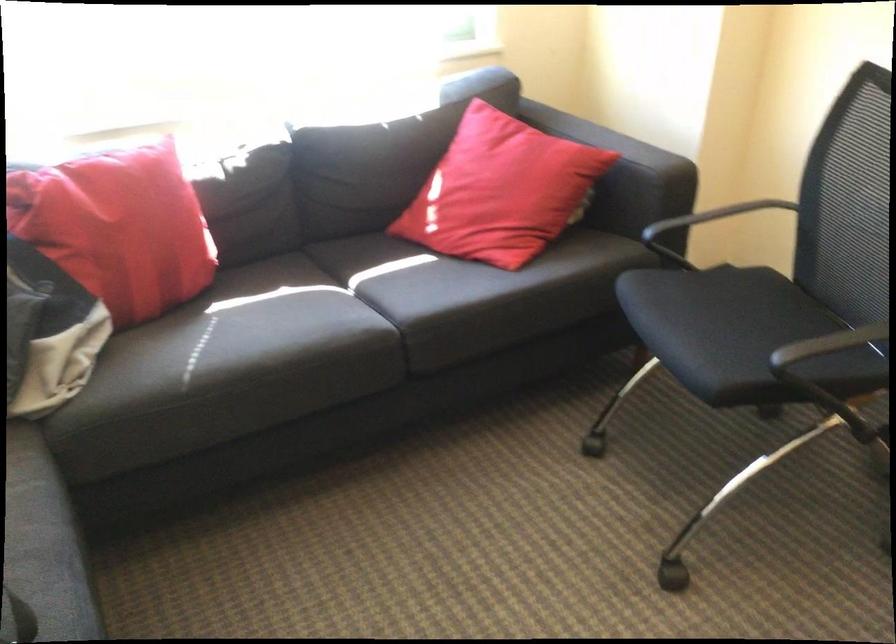
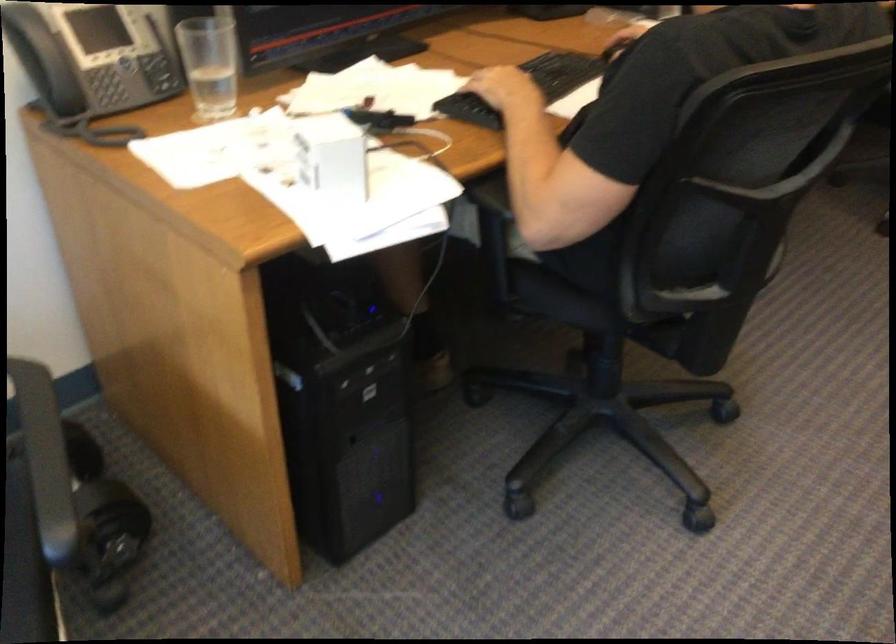
Based on the continuous images, in which direction is the camera rotating?

The camera's rotation is toward right-down.